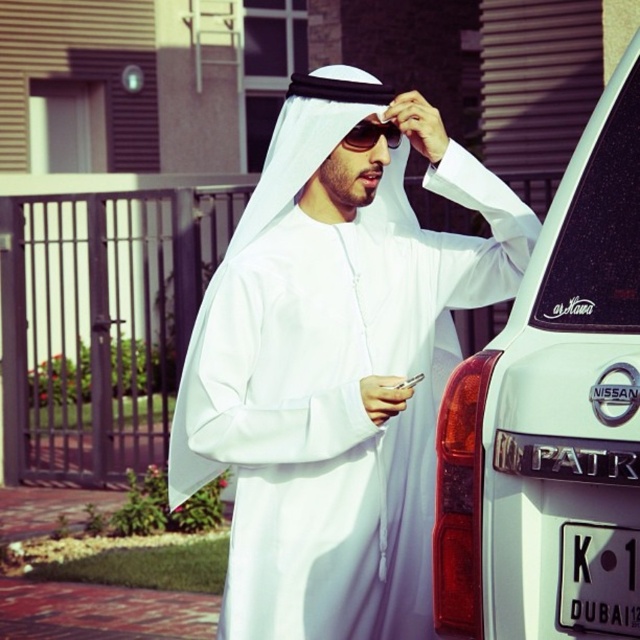
Does white matte nissan patrol at right have a lesser width compared to black plastic license plate at lower right?

No, white matte nissan patrol at right is not thinner than black plastic license plate at lower right.

Who is higher up, white matte nissan patrol at right or black plastic license plate at lower right?

white matte nissan patrol at right is higher up.

You are a GUI agent. You are given a task and a screenshot of the screen. Output one action in this format:
    pyautogui.click(x=<x>, y=<y>)
    Task: Click on the white matte nissan patrol at right
    The width and height of the screenshot is (640, 640).
    Given the screenshot: What is the action you would take?
    pyautogui.click(x=554, y=417)

Does white matte kandura at center appear on the right side of black plastic license plate at lower right?

No, white matte kandura at center is not to the right of black plastic license plate at lower right.

Consider the image. Can you confirm if white matte kandura at center is positioned below black plastic license plate at lower right?

Incorrect, white matte kandura at center is not positioned below black plastic license plate at lower right.

Locate an element on the screen. This screenshot has height=640, width=640. white matte kandura at center is located at coordinates (337, 371).

Is white matte nissan patrol at right to the right of black reflective sunglasses at upper center from the viewer's perspective?

Correct, you'll find white matte nissan patrol at right to the right of black reflective sunglasses at upper center.

Consider the image. Is white matte nissan patrol at right below black reflective sunglasses at upper center?

Correct, white matte nissan patrol at right is located below black reflective sunglasses at upper center.

The width and height of the screenshot is (640, 640). I want to click on white matte nissan patrol at right, so click(x=554, y=417).